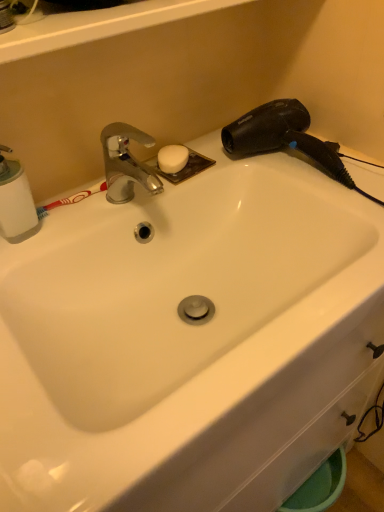
Image resolution: width=384 pixels, height=512 pixels. What are the coordinates of `free spot below black matte hair dryer at upper right (from a real-world perspective)` in the screenshot? It's located at (290, 165).